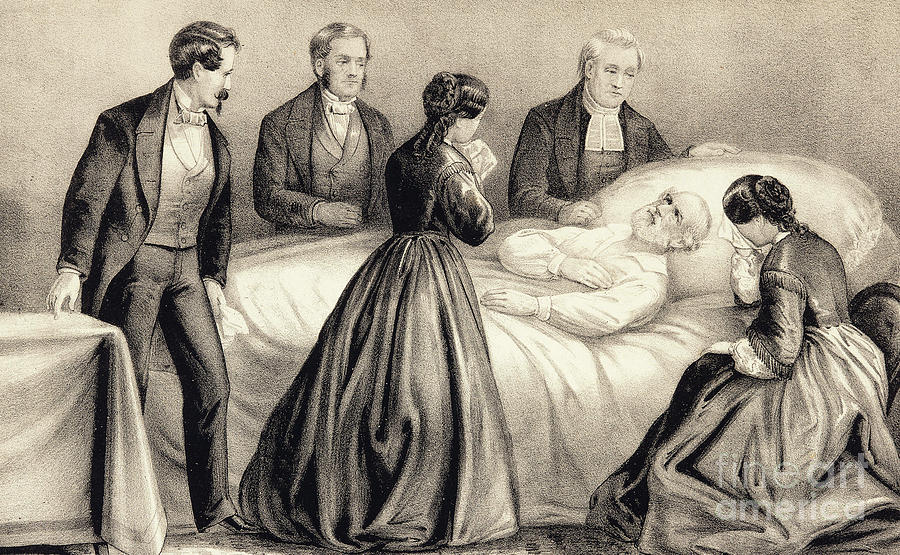
In order to click on beige wall in this screenshot , I will do (436, 54).